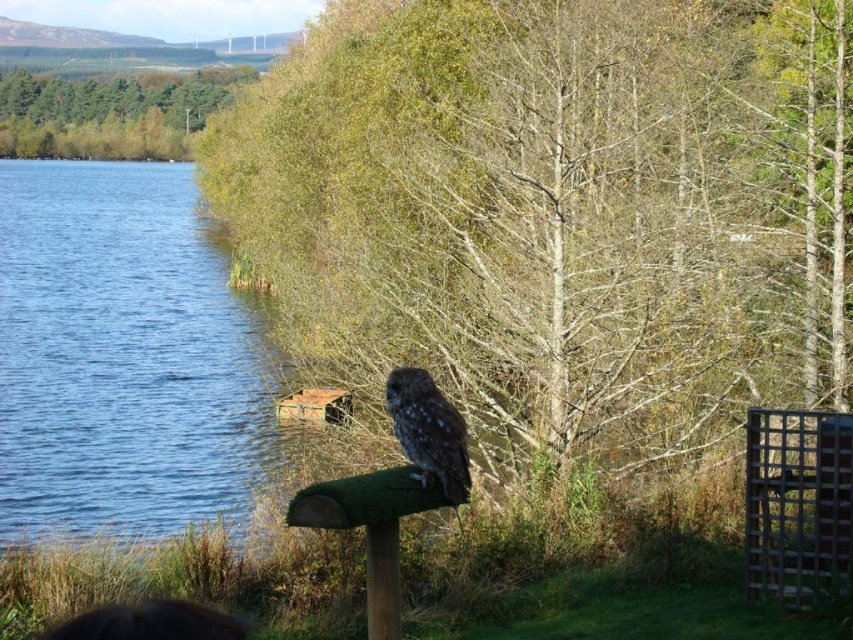
You are standing at the point labeled point (19, 86) and want to reach the point labeled point (759, 355). Which direction should you move to get closer to your destination?

To move from point (19, 86) towards point (759, 355), you should move upwards since point (759, 355) is positioned above point (19, 86) in the scene.

You are standing at the center of the image and want to locate the blue water at left. In which direction should you look to find it?

The blue water at left is located at point coordinates indicating it is on the left side of the image, so you should look to your left to find it.